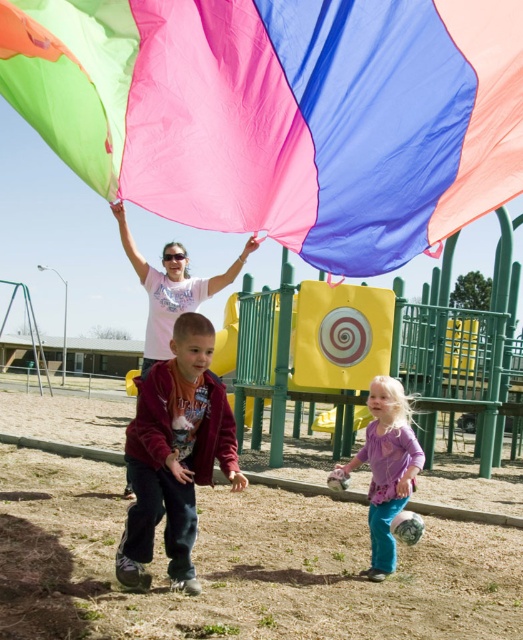
Question: Does purple soft fabric at lower right have a lesser width compared to pastel pink fabric at center?

Choices:
 (A) no
 (B) yes

Answer: (B)

Question: Estimate the real-world distances between objects in this image. Which object is closer to the purple soft fabric at lower right?

Choices:
 (A) pastel pink fabric at center
 (B) matte nylon flag at upper center

Answer: (A)

Question: Which point is farther to the camera?

Choices:
 (A) maroon fleece jacket at center
 (B) pastel pink fabric at center
 (C) matte nylon flag at upper center
 (D) purple soft fabric at lower right

Answer: (B)

Question: Which point is closer to the camera?

Choices:
 (A) matte nylon flag at upper center
 (B) pastel pink fabric at center
 (C) purple soft fabric at lower right
 (D) maroon fleece jacket at center

Answer: (A)

Question: Is maroon fleece jacket at center positioned at the back of purple soft fabric at lower right?

Choices:
 (A) yes
 (B) no

Answer: (B)

Question: Is matte nylon flag at upper center below maroon fleece jacket at center?

Choices:
 (A) no
 (B) yes

Answer: (A)